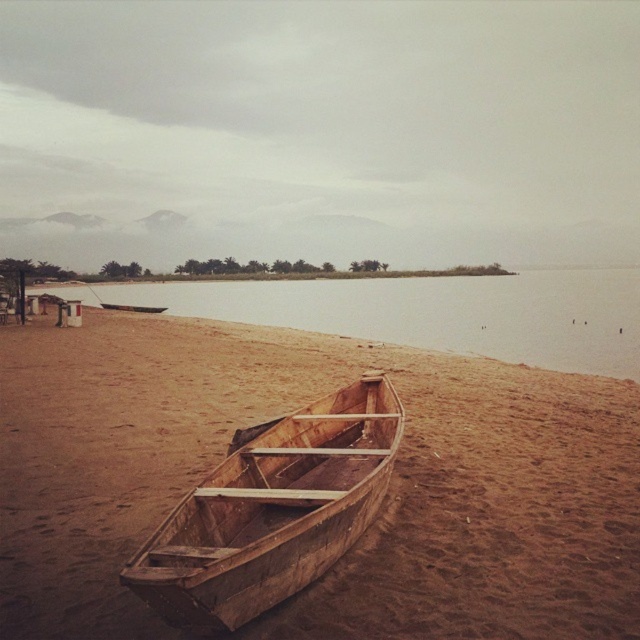
You are standing at the edge of the lake and see two points marked on the sand. The first point is at coordinates point (276,451) and the second is at point (145,308). If you want to walk from the first point to the second point, which direction should you move relative to the boat?

You should move towards the boat because point (276,451) is in front of point (145,308), meaning the second point is behind the first point relative to the boat.

You are a photographer planning to take a photo of the wooden boat at center and the wooden canoe at center. Since you want both objects to be clearly visible in the frame, which one should you focus on to ensure proper depth of field?

The wooden boat at center is smaller than the wooden canoe at center, so focusing on the wooden boat at center will ensure both are in focus as it is closer to the camera.